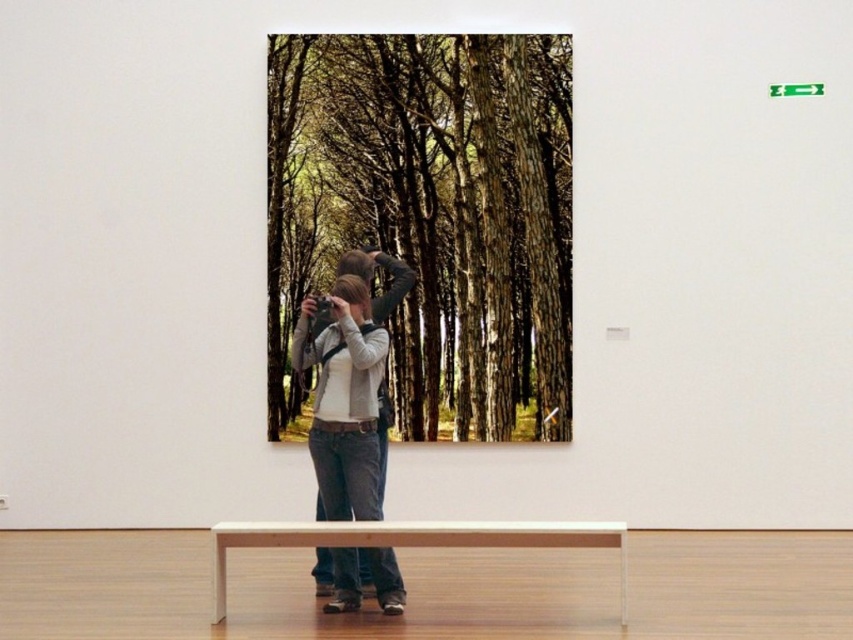
Does point (561, 150) come behind point (308, 525)?

Yes, point (561, 150) is behind point (308, 525).

Does green textured forest at center appear on the right side of light brown wooden bench at lower center?

Indeed, green textured forest at center is positioned on the right side of light brown wooden bench at lower center.

At what (x,y) coordinates should I click in order to perform the action: click on green textured forest at center. Please return your answer as a coordinate pair (x, y). Looking at the image, I should click on (428, 224).

Does light brown wooden bench at lower center have a greater width compared to denim jeans at center?

Correct, the width of light brown wooden bench at lower center exceeds that of denim jeans at center.

Does light brown wooden bench at lower center have a smaller size compared to denim jeans at center?

Actually, light brown wooden bench at lower center might be larger than denim jeans at center.

This screenshot has width=853, height=640. Find the location of `light brown wooden bench at lower center`. light brown wooden bench at lower center is located at coordinates (415, 541).

Consider the image. Measure the distance between point (508, 282) and camera.

Point (508, 282) and camera are 6.75 meters apart from each other.

Is green textured forest at center closer to the viewer compared to denim jeans at center?

No, green textured forest at center is behind denim jeans at center.

Is point (477, 256) closer to viewer compared to point (367, 593)?

That is False.

At what (x,y) coordinates should I click in order to perform the action: click on green textured forest at center. Please return your answer as a coordinate pair (x, y). The width and height of the screenshot is (853, 640). Looking at the image, I should click on (428, 224).